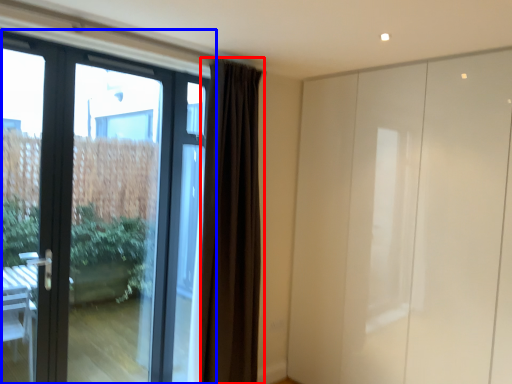
Question: Which of the following is the farthest to the observer, curtain (highlighted by a red box) or door (highlighted by a blue box)?

Choices:
 (A) curtain
 (B) door

Answer: (A)